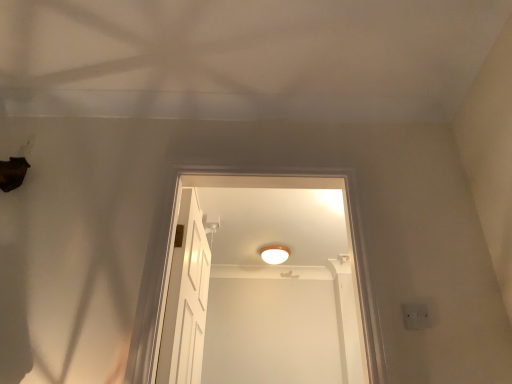
Question: Considering the relative sizes of white matte light fixture at center and white wooden door at center in the image provided, is white matte light fixture at center shorter than white wooden door at center?

Choices:
 (A) no
 (B) yes

Answer: (B)

Question: Is white matte light fixture at center far from white wooden door at center?

Choices:
 (A) yes
 (B) no

Answer: (A)

Question: Is white wooden door at center a part of white matte light fixture at center?

Choices:
 (A) no
 (B) yes

Answer: (A)

Question: Is the depth of white matte light fixture at center less than that of white wooden door at center?

Choices:
 (A) no
 (B) yes

Answer: (A)

Question: Can you confirm if white matte light fixture at center is positioned to the right of white wooden door at center?

Choices:
 (A) yes
 (B) no

Answer: (A)

Question: Could you tell me if white matte light fixture at center is facing white wooden door at center?

Choices:
 (A) yes
 (B) no

Answer: (B)

Question: Is the surface of white wooden door at center in direct contact with white matte light fixture at center?

Choices:
 (A) yes
 (B) no

Answer: (B)

Question: Is white wooden door at center to the right of white matte light fixture at center from the viewer's perspective?

Choices:
 (A) no
 (B) yes

Answer: (A)

Question: From a real-world perspective, is white wooden door at center located beneath white matte light fixture at center?

Choices:
 (A) yes
 (B) no

Answer: (A)

Question: Could you tell me if white wooden door at center is turned towards white matte light fixture at center?

Choices:
 (A) yes
 (B) no

Answer: (B)

Question: From the image's perspective, is white wooden door at center beneath white matte light fixture at center?

Choices:
 (A) yes
 (B) no

Answer: (A)

Question: Is white wooden door at center shorter than white matte light fixture at center?

Choices:
 (A) yes
 (B) no

Answer: (B)

Question: In the image, is white wooden door at center on the left side or the right side of white matte light fixture at center?

Choices:
 (A) right
 (B) left

Answer: (B)